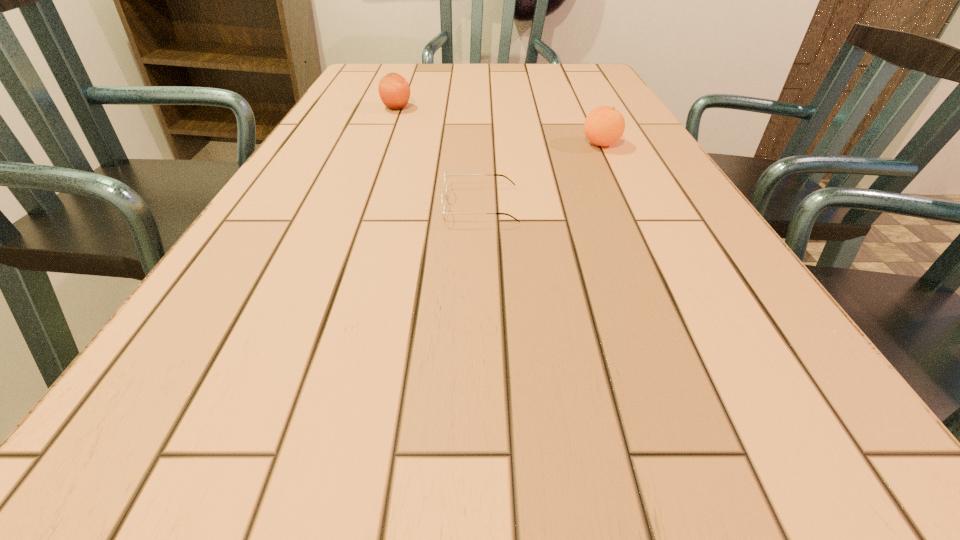
Find the location of a particular element. the farthest object is located at coordinates (394, 90).

This screenshot has width=960, height=540. What are the coordinates of `the left orange` in the screenshot? It's located at (394, 90).

Where is `the nearer orange`? The image size is (960, 540). the nearer orange is located at coordinates [x=604, y=125].

This screenshot has height=540, width=960. In order to click on the second farthest object in this screenshot , I will do `click(604, 125)`.

Identify the location of the shortest object. (446, 175).

Where is `the second object from right to left`? This screenshot has height=540, width=960. the second object from right to left is located at coordinates (446, 175).

You are a GUI agent. You are given a task and a screenshot of the screen. Output one action in this format:
    pyautogui.click(x=<x>, y=<y>)
    Task: Click on the free space located 0.140m on the left of the farther orange
    This screenshot has height=540, width=960.
    Given the screenshot: What is the action you would take?
    pyautogui.click(x=328, y=108)

At what (x,y) coordinates should I click in order to perform the action: click on free spot located on the left of the second nearest object. Please return your answer as a coordinate pair (x, y). The image size is (960, 540). Looking at the image, I should click on (546, 144).

Locate an element on the screen. Image resolution: width=960 pixels, height=540 pixels. free spot located 0.120m on the front-facing side of the nearest object is located at coordinates (376, 205).

Locate an element on the screen. This screenshot has height=540, width=960. free space located 0.130m on the front-facing side of the nearest object is located at coordinates (372, 205).